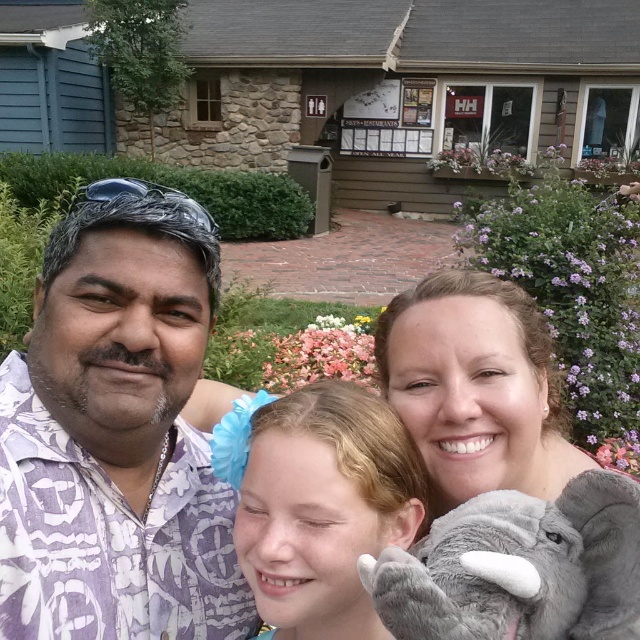
Is purple printed shirt at center further to camera compared to purple printed shirt at upper left?

No, purple printed shirt at center is in front of purple printed shirt at upper left.

At what (x,y) coordinates should I click in order to perform the action: click on purple printed shirt at center. Please return your answer as a coordinate pair (x, y). The image size is (640, 640). Looking at the image, I should click on (116, 435).

Who is positioned more to the right, purple printed shirt at upper left or gray plush elephant at lower center?

gray plush elephant at lower center

Does point (122, 368) come behind point (394, 620)?

Yes, it is.

What do you see at coordinates (116, 433) in the screenshot? The height and width of the screenshot is (640, 640). I see `purple printed shirt at upper left` at bounding box center [116, 433].

I want to click on purple printed shirt at upper left, so click(116, 433).

Which of these two, gray plush elephant at lower center or matte gray plush at center, stands shorter?

With less height is gray plush elephant at lower center.

How distant is gray plush elephant at lower center from matte gray plush at center?

The distance of gray plush elephant at lower center from matte gray plush at center is 33.43 centimeters.

Where is `gray plush elephant at lower center`? Image resolution: width=640 pixels, height=640 pixels. gray plush elephant at lower center is located at coordinates (518, 566).